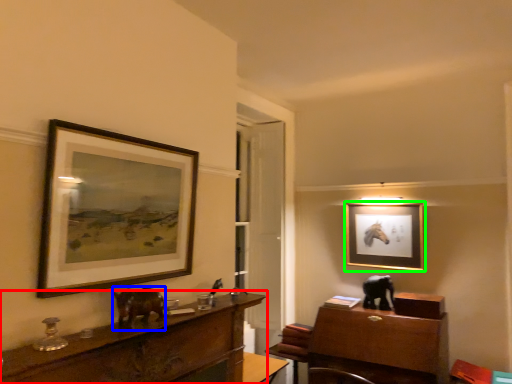
Question: Which object is the closest to the desk (highlighted by a red box)? Choose among these: animal (highlighted by a blue box) or picture frame (highlighted by a green box).

Choices:
 (A) animal
 (B) picture frame

Answer: (A)